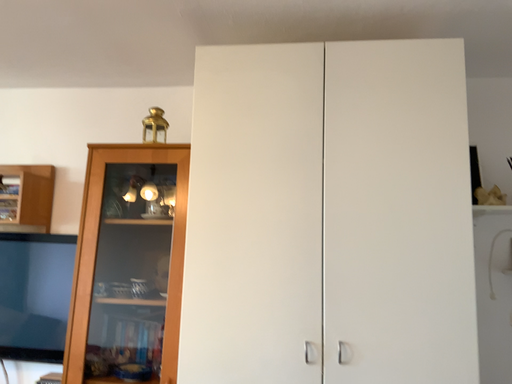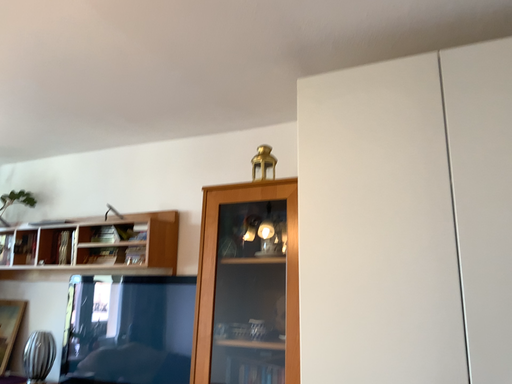
Question: Which way did the camera rotate in the video?

Choices:
 (A) rotated right
 (B) rotated left

Answer: (B)